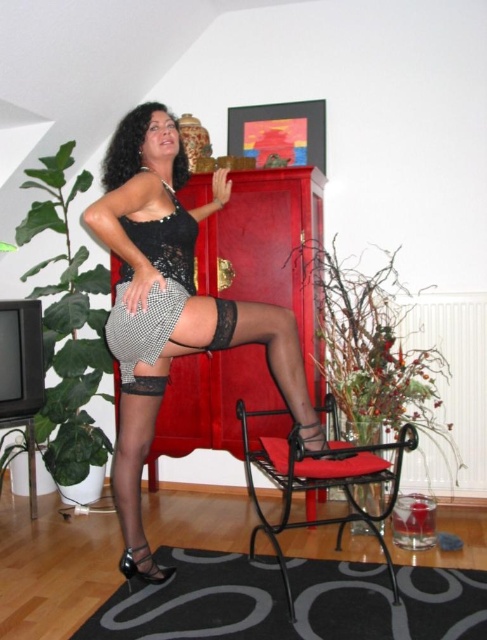
You are a photographer setting up a shoot in the room. You want to ensure the matte black stockings at center and the black metal armchair at center are both visible in the final photo. Based on their positions, which object should you focus on first to capture both clearly?

The matte black stockings at center is in front of the black metal armchair at center. To capture both clearly, focus on the black metal armchair at center first since it is further back, then adjust to ensure the stockings in front are also in focus.

You are a photographer setting up a shoot in the room. You need to position a light source to the right of both the black lace dress at center and the black lace shorts at center. Is this possible given their current positions?

The black lace dress at center is to the left of black lace shorts at center, so placing a light source to the right of both is possible as they are aligned horizontally.